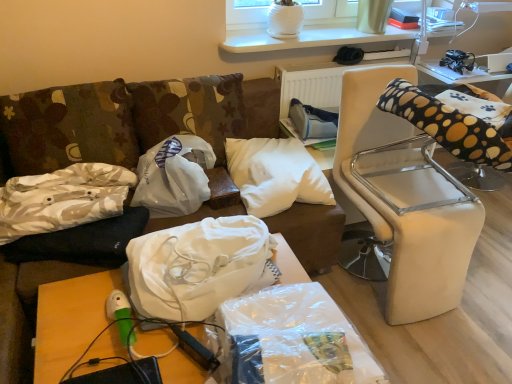
Measure the distance between point (131, 289) and camera.

Point (131, 289) is 4.50 feet from camera.

Describe the element at coordinates (174, 176) in the screenshot. This screenshot has width=512, height=384. I see `white plastic bag at center, placed as the third material when sorted from front to back` at that location.

Measure the distance between point (460, 205) and camera.

A distance of 5.73 feet exists between point (460, 205) and camera.

What do you see at coordinates (67, 128) in the screenshot?
I see `camouflage fabric pillow at left, which is the 1th pillow in left-to-right order` at bounding box center [67, 128].

This screenshot has width=512, height=384. Describe the element at coordinates (62, 199) in the screenshot. I see `camouflage fabric pillow at left, the second pillow positioned from the left` at that location.

The width and height of the screenshot is (512, 384). Identify the location of white fabric bag at center, which is the 2th material from front to back. (198, 266).

Consider the image. Does white plastic bag at center, placed as the third material when sorted from front to back, have a lesser height compared to white soft pillow at center, which is counted as the first pillow, starting from the right?

No, white plastic bag at center, placed as the third material when sorted from front to back, is not shorter than white soft pillow at center, which is counted as the first pillow, starting from the right.

Does point (177, 138) come farther from viewer compared to point (295, 186)?

Yes, point (177, 138) is behind point (295, 186).

Can you tell me how much white plastic bag at center, placed as the third material when sorted from front to back, and white soft pillow at center, acting as the 3th pillow starting from the left, differ in facing direction?

white plastic bag at center, placed as the third material when sorted from front to back, and white soft pillow at center, acting as the 3th pillow starting from the left, are facing 0.00157 degrees away from each other.

Are white plastic bag at center, which is the 1th material in back-to-front order, and white soft pillow at center, which is counted as the first pillow, starting from the right, making contact?

No, white plastic bag at center, which is the 1th material in back-to-front order, is not touching white soft pillow at center, which is counted as the first pillow, starting from the right.

From the image's perspective, is black fabric bean bag chair at right above white leather chair at right?

Yes, from the image's perspective, black fabric bean bag chair at right is on top of white leather chair at right.

Locate an element on the screen. This screenshot has width=512, height=384. bean bag chair on the right of white leather chair at right is located at coordinates (455, 130).

Considering the positions of points (461, 180) and (383, 67), is point (461, 180) farther from camera compared to point (383, 67)?

Yes, it is behind point (383, 67).

Is white soft pillow at center, which is counted as the first pillow, starting from the right, far away from clear plastic bag at lower center, the 3th material viewed from the back?

Actually, white soft pillow at center, which is counted as the first pillow, starting from the right, and clear plastic bag at lower center, the 3th material viewed from the back, are a little close together.

Considering the sizes of objects white soft pillow at center, which is counted as the first pillow, starting from the right, and clear plastic bag at lower center, which ranks as the 1th material in front-to-back order, in the image provided, who is smaller, white soft pillow at center, which is counted as the first pillow, starting from the right, or clear plastic bag at lower center, which ranks as the 1th material in front-to-back order,?

white soft pillow at center, which is counted as the first pillow, starting from the right.

Which point is more distant from viewer, (x=269, y=200) or (x=223, y=317)?

The point (x=269, y=200) is farther.

From the image's perspective, is white soft pillow at center, which is counted as the first pillow, starting from the right, located above or below clear plastic bag at lower center, which ranks as the 1th material in front-to-back order?

white soft pillow at center, which is counted as the first pillow, starting from the right, is situated higher than clear plastic bag at lower center, which ranks as the 1th material in front-to-back order, in the image.

Which object is closer to the camera, black fabric bean bag chair at right or camouflage fabric pillow at left, positioned as the 3th pillow in right-to-left order?

black fabric bean bag chair at right is closer to the camera.

From a real-world perspective, who is located lower, black fabric bean bag chair at right or camouflage fabric pillow at left, positioned as the 3th pillow in right-to-left order?

camouflage fabric pillow at left, positioned as the 3th pillow in right-to-left order, is physically lower.

Is black fabric bean bag chair at right turned away from camouflage fabric pillow at left, positioned as the 3th pillow in right-to-left order?

No, camouflage fabric pillow at left, positioned as the 3th pillow in right-to-left order, is not at the back of black fabric bean bag chair at right.

Is black fabric bean bag chair at right wider than camouflage fabric pillow at left, which is the 1th pillow in left-to-right order?

Correct, the width of black fabric bean bag chair at right exceeds that of camouflage fabric pillow at left, which is the 1th pillow in left-to-right order.

Is clear plastic bag at lower center, which ranks as the 1th material in front-to-back order, looking in the opposite direction of wooden table at lower left, acting as the 1th table starting from the bottom?

That's not correct — clear plastic bag at lower center, which ranks as the 1th material in front-to-back order, is not looking away from wooden table at lower left, acting as the 1th table starting from the bottom.

Is clear plastic bag at lower center, the 3th material viewed from the back, completely or partially outside of wooden table at lower left, acting as the second table starting from the right?

Yes, clear plastic bag at lower center, the 3th material viewed from the back, is not within wooden table at lower left, acting as the second table starting from the right.

Considering the sizes of clear plastic bag at lower center, which ranks as the 1th material in front-to-back order, and wooden table at lower left, the 2th table from the back, in the image, is clear plastic bag at lower center, which ranks as the 1th material in front-to-back order, taller or shorter than wooden table at lower left, the 2th table from the back,?

Considering their sizes, clear plastic bag at lower center, which ranks as the 1th material in front-to-back order, has less height than wooden table at lower left, the 2th table from the back.

Considering the relative sizes of white leather chair at right and white plastic bag at center, placed as the third material when sorted from front to back, in the image provided, is white leather chair at right taller than white plastic bag at center, placed as the third material when sorted from front to back,?

Yes.

Can you tell me how much white leather chair at right and white plastic bag at center, which is the 1th material in back-to-front order, differ in facing direction?

The facing directions of white leather chair at right and white plastic bag at center, which is the 1th material in back-to-front order, are 0.342 degrees apart.

Is point (386, 237) positioned behind point (151, 170)?

No, it is in front of (151, 170).

Based on the photo, between white leather chair at right and white plastic bag at center, which is the 1th material in back-to-front order, which one appears on the left side from the viewer's perspective?

white plastic bag at center, which is the 1th material in back-to-front order.

From the image's perspective, which is above, clear plastic table at upper right, which is the 1th table in right-to-left order, or clear plastic bag at lower center, the 3th material viewed from the back?

From the image's view, clear plastic table at upper right, which is the 1th table in right-to-left order, is above.

At what (x,y) coordinates should I click in order to perform the action: click on the 3rd material in front of the clear plastic table at upper right, the 2th table in the bottom-to-top sequence. Please return your answer as a coordinate pair (x, y). This screenshot has width=512, height=384. Looking at the image, I should click on (297, 337).

Are clear plastic table at upper right, which appears as the second table when viewed from the front, and clear plastic bag at lower center, which ranks as the 1th material in front-to-back order, located far from each other?

Yes, clear plastic table at upper right, which appears as the second table when viewed from the front, and clear plastic bag at lower center, which ranks as the 1th material in front-to-back order, are located far from each other.

The height and width of the screenshot is (384, 512). Find the location of `pillow on the right of white plastic bag at center, which is the 1th material in back-to-front order`. pillow on the right of white plastic bag at center, which is the 1th material in back-to-front order is located at coordinates (275, 175).

Where is `furniture that is on the left side of black fabric bean bag chair at right`? The height and width of the screenshot is (384, 512). furniture that is on the left side of black fabric bean bag chair at right is located at coordinates (405, 198).

Based on their spatial positions, is white fabric bag at center, which is the 2th material in back-to-front order, or wooden table at lower left, placed as the second table when sorted from top to bottom, closer to camouflage fabric pillow at left, which is the 1th pillow in left-to-right order?

wooden table at lower left, placed as the second table when sorted from top to bottom, is closer to camouflage fabric pillow at left, which is the 1th pillow in left-to-right order.

Looking at the image, which one is located closer to clear plastic table at upper right, which appears as the second table when viewed from the front, black fabric bean bag chair at right or white fabric bag at center, which is the 2th material from front to back?

The object closer to clear plastic table at upper right, which appears as the second table when viewed from the front, is black fabric bean bag chair at right.

When comparing their distances from clear plastic bag at lower center, which ranks as the 1th material in front-to-back order, does camouflage fabric pillow at left, positioned as the second pillow in right-to-left order, or white soft pillow at center, which is counted as the first pillow, starting from the right, seem closer?

The object closer to clear plastic bag at lower center, which ranks as the 1th material in front-to-back order, is white soft pillow at center, which is counted as the first pillow, starting from the right.

Based on the photo, which object lies nearer to the anchor point camouflage fabric pillow at left, the second pillow positioned from the left, clear plastic table at upper right, the first table in the top-to-bottom sequence, or white plastic bag at center, placed as the third material when sorted from front to back?

white plastic bag at center, placed as the third material when sorted from front to back, lies closer to camouflage fabric pillow at left, the second pillow positioned from the left, than the other object.

Considering their positions, is white leather chair at right positioned closer to black fabric bean bag chair at right than clear plastic table at upper right, the 1th table in the back-to-front sequence?

white leather chair at right is positioned closer to the anchor black fabric bean bag chair at right.

Which object lies further to the anchor point clear plastic table at upper right, which is the 1th table in right-to-left order, white soft pillow at center, which is counted as the first pillow, starting from the right, or black fabric bean bag chair at right?

white soft pillow at center, which is counted as the first pillow, starting from the right, is positioned further to the anchor clear plastic table at upper right, which is the 1th table in right-to-left order.

Consider the image. Based on their spatial positions, is white plastic bag at center, placed as the third material when sorted from front to back, or white soft pillow at center, which is counted as the first pillow, starting from the right, further from clear plastic bag at lower center, the 3th material viewed from the back?

Based on the image, white plastic bag at center, placed as the third material when sorted from front to back, appears to be further to clear plastic bag at lower center, the 3th material viewed from the back.

Which object lies further to the anchor point camouflage fabric pillow at left, positioned as the second pillow in right-to-left order, clear plastic bag at lower center, which ranks as the 1th material in front-to-back order, or white plastic bag at center, which is the 1th material in back-to-front order?

Based on the image, clear plastic bag at lower center, which ranks as the 1th material in front-to-back order, appears to be further to camouflage fabric pillow at left, positioned as the second pillow in right-to-left order.

Where is `pillow between white fabric bag at center, which is the 2th material in back-to-front order, and clear plastic table at upper right, the 2th table in the bottom-to-top sequence, from left to right`? The height and width of the screenshot is (384, 512). pillow between white fabric bag at center, which is the 2th material in back-to-front order, and clear plastic table at upper right, the 2th table in the bottom-to-top sequence, from left to right is located at coordinates (275, 175).

Locate an element on the screen. The width and height of the screenshot is (512, 384). furniture between clear plastic bag at lower center, the 3th material viewed from the back, and white soft pillow at center, which is counted as the first pillow, starting from the right, from front to back is located at coordinates (405, 198).

Find the location of a particular element. This screenshot has height=384, width=512. table between camouflage fabric pillow at left, positioned as the second pillow in right-to-left order, and white leather chair at right from left to right is located at coordinates (70, 321).

At what (x,y) coordinates should I click in order to perform the action: click on pillow located between wooden table at lower left, placed as the second table when sorted from top to bottom, and clear plastic table at upper right, which appears as the second table when viewed from the front, in the left-right direction. Please return your answer as a coordinate pair (x, y). This screenshot has width=512, height=384. Looking at the image, I should click on (275, 175).